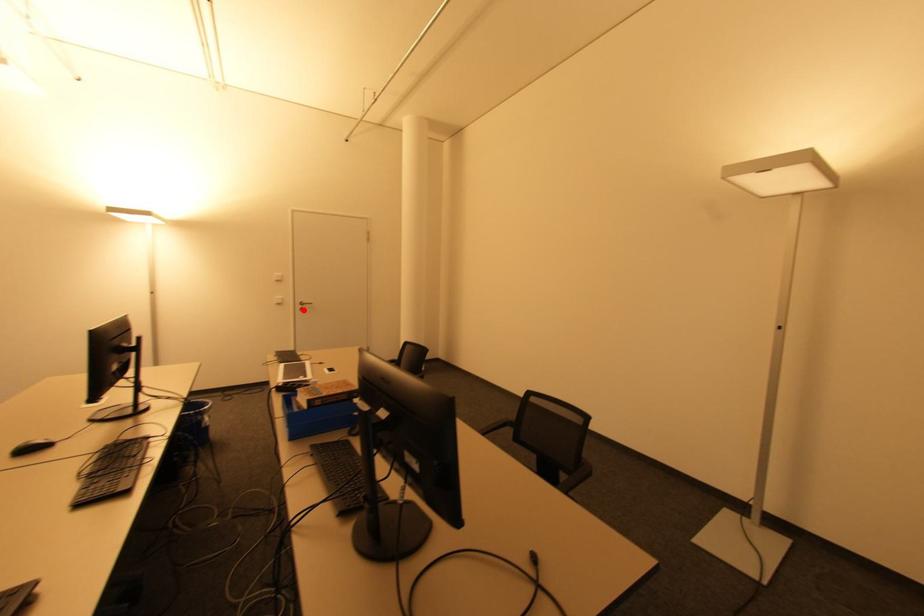
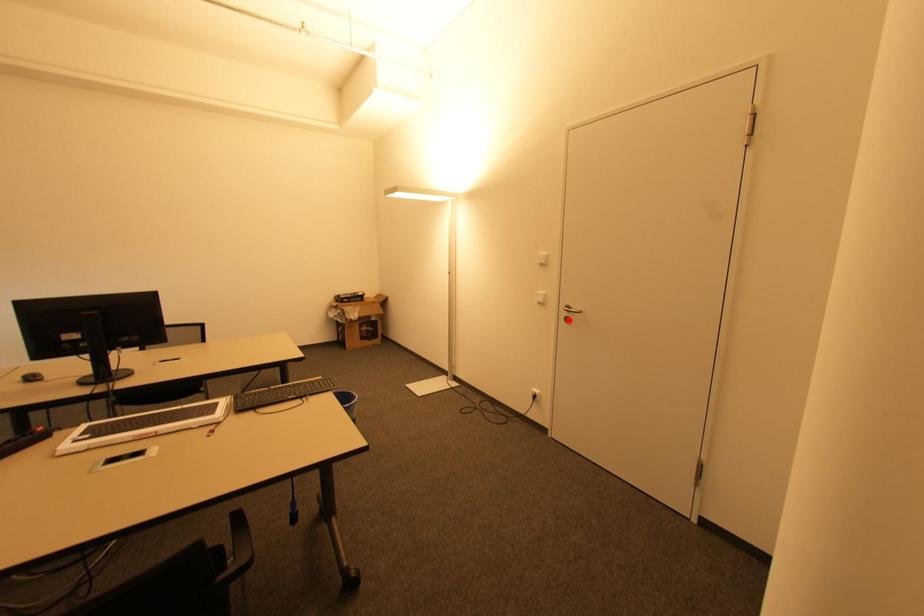
I am providing you with two images of the same scene from different viewpoints. A red point is marked on the first image and another point is marked on the second image. Are the points marked in image1 and image2 representing the same 3D position?

Yes